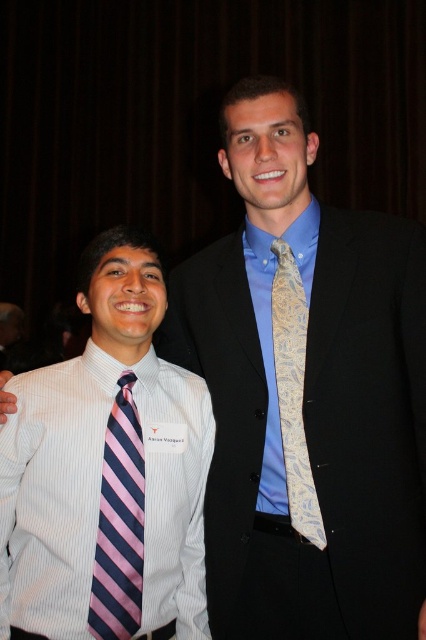
What do you see at coordinates (371, 412) in the screenshot? I see `silky blue shirt at center` at bounding box center [371, 412].

Can you confirm if silky blue shirt at center is shorter than light blue paisley tie at center?

Incorrect, silky blue shirt at center's height does not fall short of light blue paisley tie at center's.

Between point (333, 467) and point (298, 480), which one is positioned behind?

The point (298, 480) is behind.

Identify the location of silky blue shirt at center. (371, 412).

Is point (356, 424) positioned behind point (166, 385)?

No, it is not.

Does silky blue shirt at center appear under white striped dress shirt at left?

No.

Does point (379, 572) come behind point (92, 532)?

Yes, point (379, 572) is farther from viewer.

Locate an element on the screen. This screenshot has width=426, height=640. silky blue shirt at center is located at coordinates (371, 412).

Which is behind, point (88, 374) or point (290, 388)?

The point (290, 388) is behind.

Does white striped dress shirt at left have a greater height compared to light blue paisley tie at center?

No.

This screenshot has width=426, height=640. What do you see at coordinates (52, 493) in the screenshot?
I see `white striped dress shirt at left` at bounding box center [52, 493].

I want to click on white striped dress shirt at left, so click(x=52, y=493).